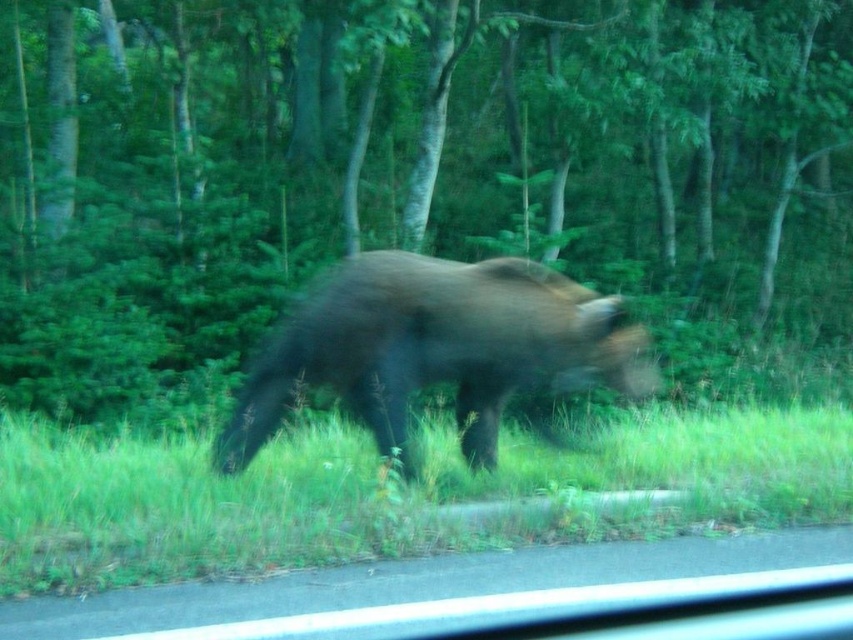
Question: Does green grass at lower center have a larger size compared to brown furry bear at center?

Choices:
 (A) yes
 (B) no

Answer: (B)

Question: Does green leafy tree at center appear on the right side of green grass at lower center?

Choices:
 (A) yes
 (B) no

Answer: (A)

Question: Which object is the closest to the green leafy tree at center?

Choices:
 (A) green grass at lower center
 (B) brown furry bear at center

Answer: (B)

Question: Which of the following is the closest to the observer?

Choices:
 (A) (350, 384)
 (B) (572, 220)

Answer: (A)

Question: Which object is the closest to the green grass at lower center?

Choices:
 (A) brown furry bear at center
 (B) green leafy tree at center

Answer: (A)

Question: Can you confirm if green leafy tree at center is wider than green grass at lower center?

Choices:
 (A) no
 (B) yes

Answer: (B)